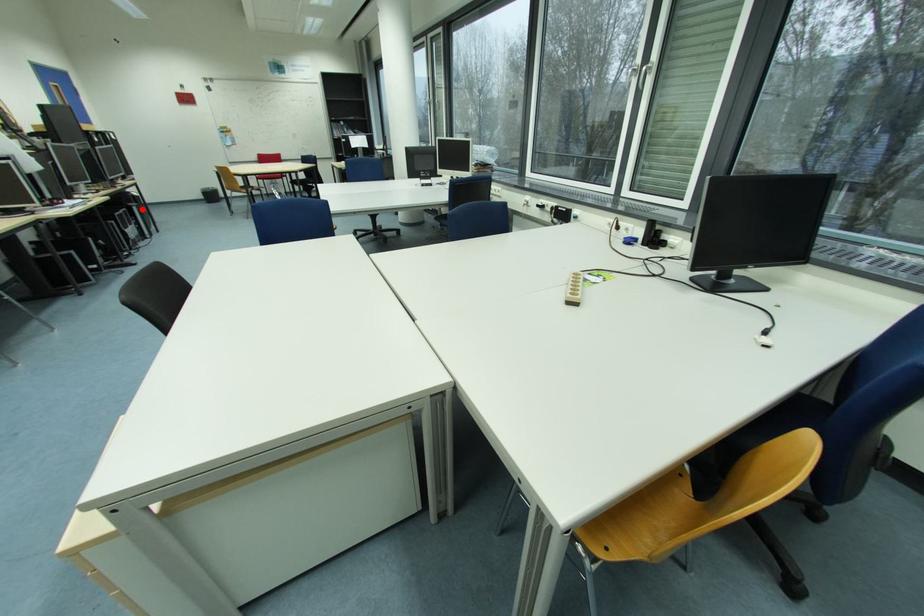
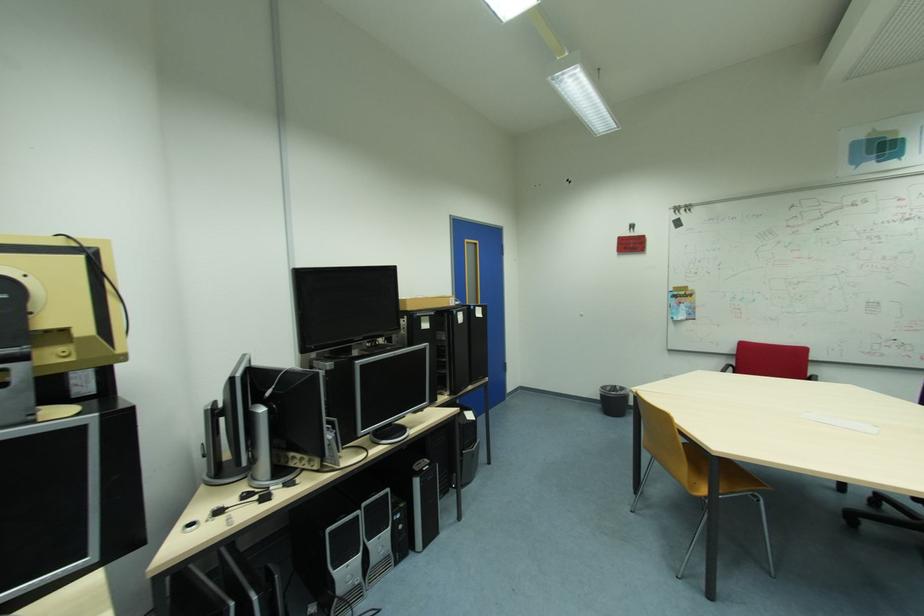
Where in the second image is the point corresponding to the highlighted location from the first image?

(424, 482)